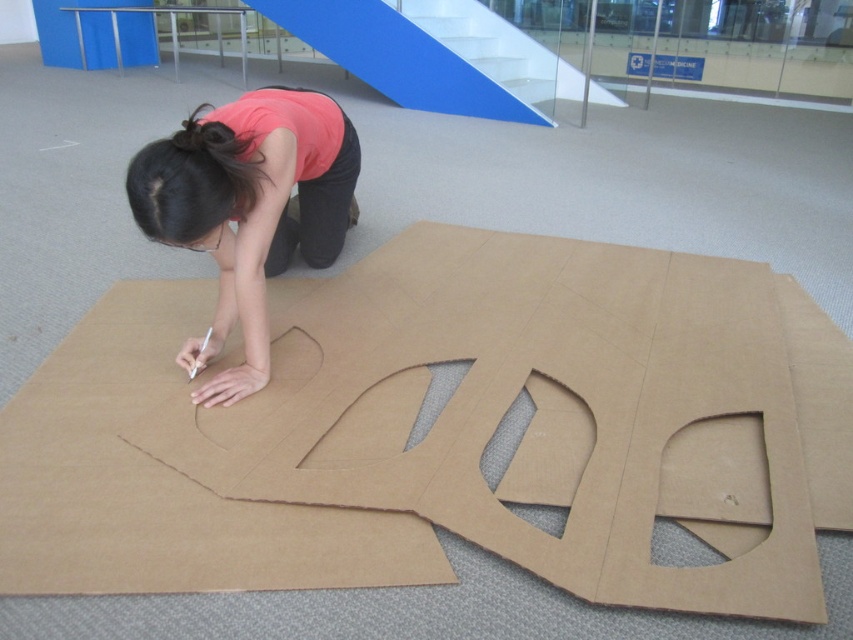
You are a robot trying to locate the brown cardboard at center in the image. The point with coordinates (x=438, y=429) is part of the brown cardboard at center. What is the location of this point relative to the brown cardboard?

The point with coordinates (x=438, y=429) is located on the brown cardboard at center.

You are a photographer setting up a shoot in this room. You need to ensure that the brown cardboard at center does not block the view of the pink matte shirt at center in your photos. Based on their heights, is this possible?

The brown cardboard at center has a greater height compared to the pink matte shirt at center. Therefore, the brown cardboard at center could potentially block the view of the pink matte shirt at center if positioned between the camera and the shirt.

You are a photographer trying to capture the person crafting. Since you want to focus on the pink matte shirt at center and the black hair at upper center, which object should you adjust your camera to prioritize in the foreground?

The pink matte shirt at center should be prioritized in the foreground because it is closer to the viewer compared to the black hair at upper center.